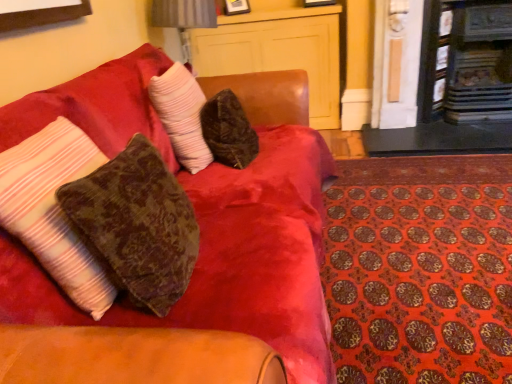
Locate an element on the screen. matte wood dresser at upper center is located at coordinates (278, 52).

The image size is (512, 384). Describe the element at coordinates (459, 85) in the screenshot. I see `dark wood fireplace at upper right, the second fireplace from the right` at that location.

In order to face black metal fireplace at upper right, the first fireplace when ordered from right to left, should I rotate leftwards or rightwards?

Rotate your view right by about 28.393°.

What do you see at coordinates (136, 226) in the screenshot? I see `velvet brown pillow at center, the 2th pillow from the front` at bounding box center [136, 226].

In order to face metallic silver table lamp at upper center, should I rotate leftwards or rightwards?

Turn left by 8.661 degrees to look at metallic silver table lamp at upper center.

Locate an element on the screen. Image resolution: width=512 pixels, height=384 pixels. matte wood dresser at upper center is located at coordinates (278, 52).

From a real-world perspective, does matte wood dresser at upper center stand above ruffled white pillow at center, which is counted as the first pillow, starting from the back?

No, from a real-world perspective, matte wood dresser at upper center is not on top of ruffled white pillow at center, which is counted as the first pillow, starting from the back.

Is matte wood dresser at upper center far away from ruffled white pillow at center, which appears as the 3th pillow when viewed from the front?

Yes, matte wood dresser at upper center is far from ruffled white pillow at center, which appears as the 3th pillow when viewed from the front.

Looking at this image, choose the correct answer: Is matte wood dresser at upper center inside ruffled white pillow at center, which appears as the 3th pillow when viewed from the front, or outside it?

matte wood dresser at upper center lies outside ruffled white pillow at center, which appears as the 3th pillow when viewed from the front.

Consider the image. Is metallic silver table lamp at upper center aimed at ruffled white pillow at center, which appears as the 3th pillow when viewed from the front?

No, metallic silver table lamp at upper center is not turned towards ruffled white pillow at center, which appears as the 3th pillow when viewed from the front.

In the scene shown: From the image's perspective, is metallic silver table lamp at upper center over ruffled white pillow at center, which is counted as the first pillow, starting from the back?

Yes, from the image's perspective, metallic silver table lamp at upper center is on top of ruffled white pillow at center, which is counted as the first pillow, starting from the back.

Considering the positions of objects metallic silver table lamp at upper center and ruffled white pillow at center, which appears as the 3th pillow when viewed from the front, in the image provided, who is behind, metallic silver table lamp at upper center or ruffled white pillow at center, which appears as the 3th pillow when viewed from the front,?

metallic silver table lamp at upper center is more distant.

Which of these two, velvet brown pillow at center, the second pillow viewed from the back, or ruffled white pillow at center, which is counted as the first pillow, starting from the back, is smaller?

Smaller between the two is velvet brown pillow at center, the second pillow viewed from the back.

Is velvet brown pillow at center, the 2th pillow from the front, facing away from ruffled white pillow at center, which is counted as the first pillow, starting from the back?

No, velvet brown pillow at center, the 2th pillow from the front, is not facing the opposite direction of ruffled white pillow at center, which is counted as the first pillow, starting from the back.

Locate an element on the screen. This screenshot has width=512, height=384. the 1st pillow in front of the ruffled white pillow at center, which appears as the 3th pillow when viewed from the front, counting from the anchor's position is located at coordinates (136, 226).

Is velvet brown pillow at center, the 2th pillow from the front, taller or shorter than ruffled white pillow at center, which appears as the 3th pillow when viewed from the front?

In the image, velvet brown pillow at center, the 2th pillow from the front, appears to be shorter than ruffled white pillow at center, which appears as the 3th pillow when viewed from the front.

How different are the orientations of velvet-like brown couch at upper left and matte wood dresser at upper center in degrees?

89.6 degrees.

From a real-world perspective, is velvet-like brown couch at upper left positioned above or below matte wood dresser at upper center?

velvet-like brown couch at upper left is situated higher than matte wood dresser at upper center in the real world.

Can matte wood dresser at upper center be found inside velvet-like brown couch at upper left?

No, matte wood dresser at upper center is not inside velvet-like brown couch at upper left.

From the image's perspective, is velvet-like brown couch at upper left above or below dark wood fireplace at upper right, arranged as the 1th fireplace when viewed from the left?

velvet-like brown couch at upper left is situated lower than dark wood fireplace at upper right, arranged as the 1th fireplace when viewed from the left, in the image.

From a real-world perspective, between velvet-like brown couch at upper left and dark wood fireplace at upper right, the second fireplace from the right, who is vertically lower?

velvet-like brown couch at upper left, from a real-world perspective.

Which of these two, velvet-like brown couch at upper left or dark wood fireplace at upper right, the second fireplace from the right, is smaller?

dark wood fireplace at upper right, the second fireplace from the right, is smaller.

Can you confirm if velvet-like brown couch at upper left is shorter than dark wood fireplace at upper right, arranged as the 1th fireplace when viewed from the left?

Indeed, velvet-like brown couch at upper left has a lesser height compared to dark wood fireplace at upper right, arranged as the 1th fireplace when viewed from the left.

Is orange patterned mat at lower right not inside black metal fireplace at upper right, the first fireplace when ordered from right to left?

orange patterned mat at lower right lies outside black metal fireplace at upper right, the first fireplace when ordered from right to left,'s area.

Considering the positions of objects orange patterned mat at lower right and black metal fireplace at upper right, the first fireplace when ordered from right to left, in the image provided, who is more to the right, orange patterned mat at lower right or black metal fireplace at upper right, the first fireplace when ordered from right to left,?

From the viewer's perspective, black metal fireplace at upper right, the first fireplace when ordered from right to left, appears more on the right side.

Is point (428, 216) closer to viewer compared to point (494, 84)?

Yes, it is in front of point (494, 84).

Consider the image. In terms of width, does matte wood dresser at upper center look wider or thinner when compared to velvet brown pillow at center, the second pillow viewed from the back?

Considering their sizes, matte wood dresser at upper center looks broader than velvet brown pillow at center, the second pillow viewed from the back.

Do you think matte wood dresser at upper center is within velvet brown pillow at center, the second pillow viewed from the back, or outside of it?

matte wood dresser at upper center is outside velvet brown pillow at center, the second pillow viewed from the back.

Is matte wood dresser at upper center facing away from velvet brown pillow at center, the second pillow viewed from the back?

That's not correct — matte wood dresser at upper center is not looking away from velvet brown pillow at center, the second pillow viewed from the back.

Are matte wood dresser at upper center and velvet brown pillow at center, the 2th pillow from the front, far apart?

matte wood dresser at upper center is far away from velvet brown pillow at center, the 2th pillow from the front.

The height and width of the screenshot is (384, 512). Identify the location of dresser behind the ruffled white pillow at center, which is counted as the first pillow, starting from the back. (278, 52).

This screenshot has width=512, height=384. In order to click on table lamp lying on the left of ruffled white pillow at center, which is counted as the first pillow, starting from the back in this screenshot , I will do `click(184, 18)`.

From the image, which object appears to be farther from orange patterned mat at lower right, velvet-like brown couch at upper left or metallic silver table lamp at upper center?

metallic silver table lamp at upper center.

Considering their positions, is velvet-like brown couch at upper left positioned further to matte wood dresser at upper center than black metal fireplace at upper right, the second fireplace viewed from the left?

velvet-like brown couch at upper left lies further to matte wood dresser at upper center than the other object.

From the image, which object appears to be nearer to velvet brown pillow at center, the 2th pillow from the front, black metal fireplace at upper right, the second fireplace viewed from the left, or velvet-like brown couch at upper left?

velvet-like brown couch at upper left lies closer to velvet brown pillow at center, the 2th pillow from the front, than the other object.

From the image, which object appears to be nearer to matte wood dresser at upper center, velvet brown pillow at left, arranged as the 3th pillow when viewed from the back, or orange patterned mat at lower right?

orange patterned mat at lower right is positioned closer to the anchor matte wood dresser at upper center.

Which object lies further to the anchor point orange patterned mat at lower right, matte wood dresser at upper center or metallic silver table lamp at upper center?

Based on the image, metallic silver table lamp at upper center appears to be further to orange patterned mat at lower right.

When comparing their distances from dark wood fireplace at upper right, the second fireplace from the right, does velvet-like brown couch at upper left or ruffled white pillow at center, which appears as the 3th pillow when viewed from the front, seem further?

Among the two, ruffled white pillow at center, which appears as the 3th pillow when viewed from the front, is located further to dark wood fireplace at upper right, the second fireplace from the right.

Considering their positions, is black metal fireplace at upper right, the second fireplace viewed from the left, positioned closer to velvet brown pillow at left, which is the first pillow in front-to-back order, than ruffled white pillow at center, which is counted as the first pillow, starting from the back?

The object closer to velvet brown pillow at left, which is the first pillow in front-to-back order, is ruffled white pillow at center, which is counted as the first pillow, starting from the back.

Considering their positions, is metallic silver table lamp at upper center positioned closer to velvet-like brown couch at upper left than ruffled white pillow at center, which appears as the 3th pillow when viewed from the front?

ruffled white pillow at center, which appears as the 3th pillow when viewed from the front, lies closer to velvet-like brown couch at upper left than the other object.

You are a GUI agent. You are given a task and a screenshot of the screen. Output one action in this format:
    pyautogui.click(x=<x>, y=<y>)
    Task: Click on the table lamp positioned between velvet brown pillow at left, arranged as the 3th pillow when viewed from the back, and matte wood dresser at upper center from near to far
    The image size is (512, 384).
    Given the screenshot: What is the action you would take?
    pyautogui.click(x=184, y=18)

Identify the location of pillow between ruffled white pillow at center, which is counted as the first pillow, starting from the back, and dark wood fireplace at upper right, the second fireplace from the right. The height and width of the screenshot is (384, 512). (136, 226).

Where is `mat between velvet brown pillow at left, arranged as the 3th pillow when viewed from the back, and black metal fireplace at upper right, the first fireplace when ordered from right to left`? This screenshot has width=512, height=384. mat between velvet brown pillow at left, arranged as the 3th pillow when viewed from the back, and black metal fireplace at upper right, the first fireplace when ordered from right to left is located at coordinates (420, 269).

Where is `mat between velvet brown pillow at center, the 2th pillow from the front, and black metal fireplace at upper right, the second fireplace viewed from the left, in the front-back direction`? This screenshot has height=384, width=512. mat between velvet brown pillow at center, the 2th pillow from the front, and black metal fireplace at upper right, the second fireplace viewed from the left, in the front-back direction is located at coordinates (420, 269).